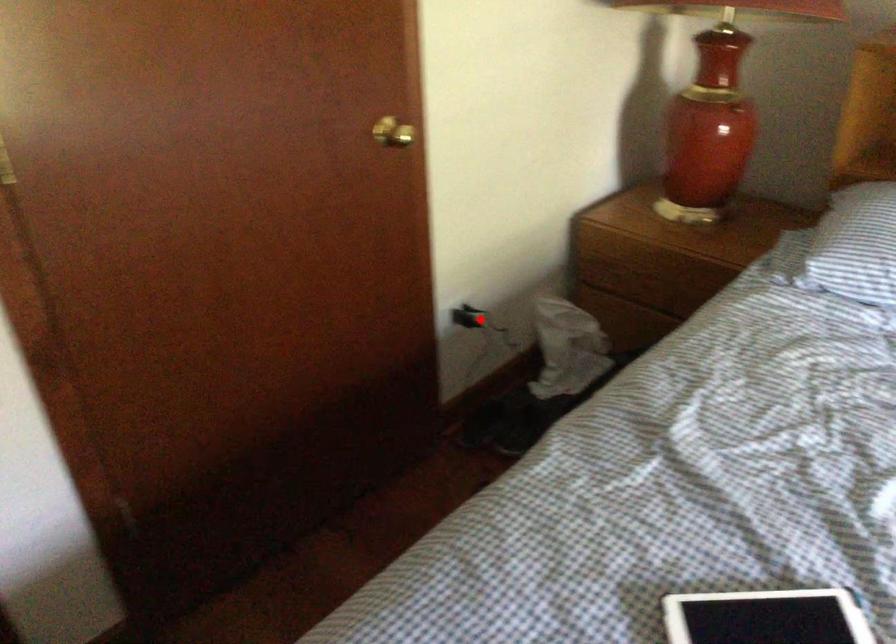
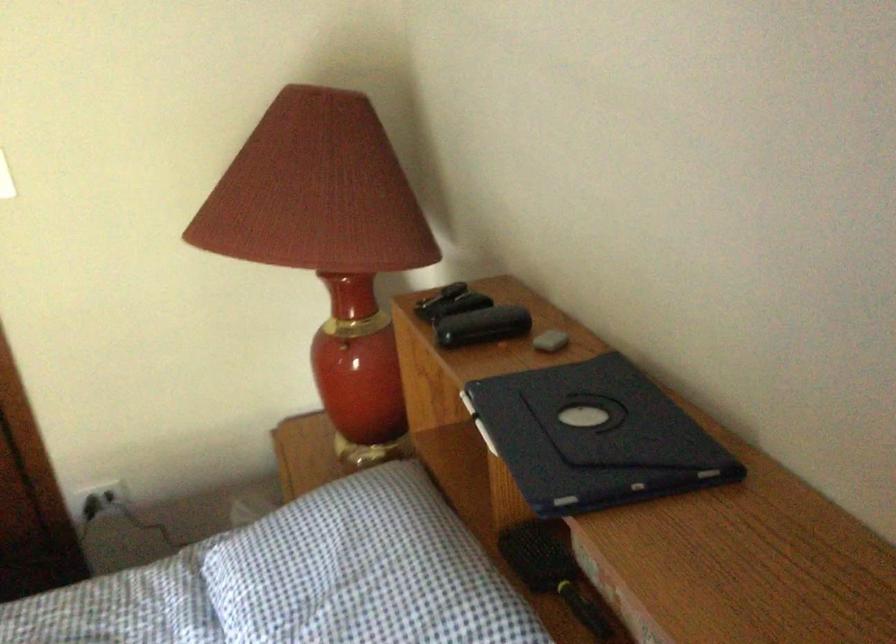
The point at the highlighted location is marked in the first image. Where is the corresponding point in the second image?

(99, 500)